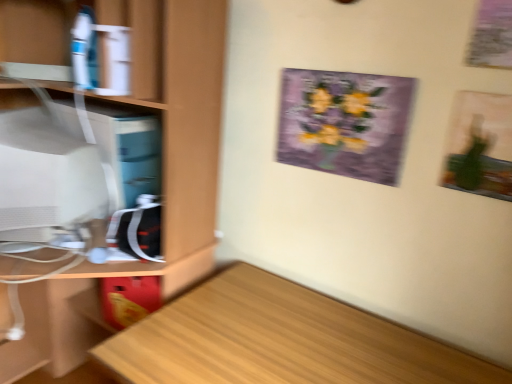
Question: From the image's perspective, relative to light wood desk at lower left, is wooden cabinet at left above or below?

Choices:
 (A) above
 (B) below

Answer: (A)

Question: Considering the positions of point coord(215,132) and point coord(433,342), is point coord(215,132) closer or farther from the camera than point coord(433,342)?

Choices:
 (A) closer
 (B) farther

Answer: (B)

Question: Which object is the closest to the wooden cabinet at left?

Choices:
 (A) purple paper picture frame at upper center
 (B) matte white monitor at left
 (C) light wood desk at lower left

Answer: (B)

Question: Which object is the farthest from the light wood desk at lower left?

Choices:
 (A) matte white monitor at left
 (B) wooden cabinet at left
 (C) purple paper picture frame at upper center

Answer: (A)